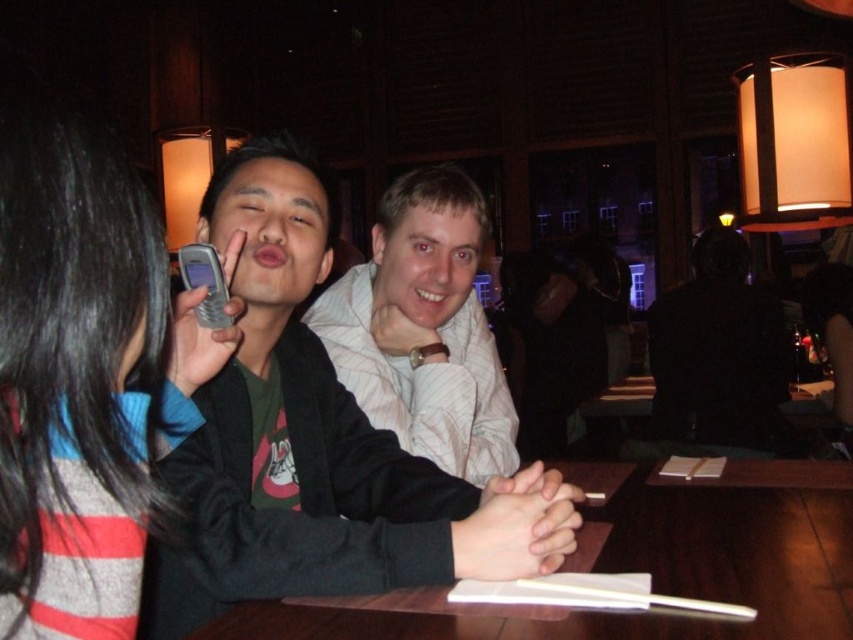
You are a photographer adjusting your camera settings to capture a closeup of both the striped fabric hair at left and the silver metallic phone at center. Given the camera has a focal length of 50mm and a sensor size of 24mm x 36mm, what is the minimum distance you need to stand from the subjects to ensure both are in focus with a depth of field that accommodates their separation?

The minimum distance required is calculated using the hyperfocal distance formula. With a 50mm lens, 24x36mm sensor, and the objects 28.27cm apart, the hyperfocal distance ensures both the striped fabric hair at left and silver metallic phone at center are in focus. At f8 aperture, this distance is approximately 1.2 meters.

You are a photographer trying to capture a clear shot of the striped fabric hair at left and the silver metallic phone at center. Since the camera can only focus on one object at a time, which object should you choose to ensure it appears sharp and in focus, considering their relative sizes?

The striped fabric hair at left has a greater height compared to the silver metallic phone at center, so you should focus on the striped fabric hair at left to ensure it appears sharp and in focus.